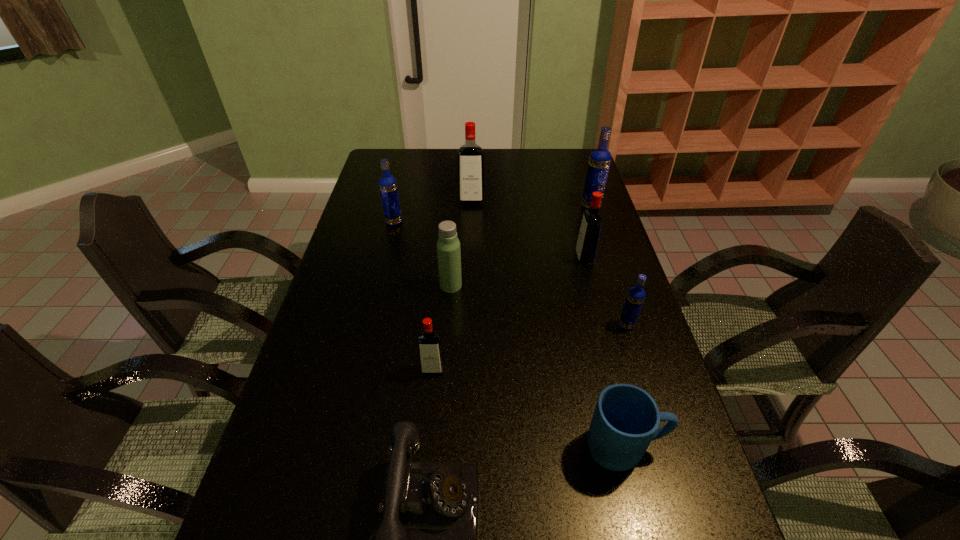
Where is `the fourth nearest object`? This screenshot has height=540, width=960. the fourth nearest object is located at coordinates point(636,295).

At what (x,y) coordinates should I click in order to perform the action: click on the nearest red vodka. Please return your answer as a coordinate pair (x, y). Looking at the image, I should click on (430, 350).

You are a GUI agent. You are given a task and a screenshot of the screen. Output one action in this format:
    pyautogui.click(x=<x>, y=<y>)
    Task: Click on the smallest red vodka
    Image resolution: width=960 pixels, height=540 pixels.
    Given the screenshot: What is the action you would take?
    pyautogui.click(x=430, y=350)

You are a GUI agent. You are given a task and a screenshot of the screen. Output one action in this format:
    pyautogui.click(x=<x>, y=<y>)
    Task: Click on the blue mug
    This screenshot has height=540, width=960.
    Given the screenshot: What is the action you would take?
    point(626,418)

Where is `vacant area situated on the back of the biggest blue vodka`? vacant area situated on the back of the biggest blue vodka is located at coordinates (583, 180).

In order to click on vacant space situated 0.270m on the front and back of the biggest red vodka in this screenshot , I will do `click(470, 253)`.

Find the location of a particular element. This screenshot has height=540, width=960. free space located on the right of the leftmost object is located at coordinates (427, 222).

Locate an element on the screen. This screenshot has height=540, width=960. vacant space located 0.200m on the front and back of the second nearest red vodka is located at coordinates (514, 259).

Where is `free space located 0.360m on the front and back of the second nearest red vodka`? free space located 0.360m on the front and back of the second nearest red vodka is located at coordinates (464, 259).

Identify the location of free location located 0.100m on the front and back of the second nearest red vodka. The image size is (960, 540). (544, 259).